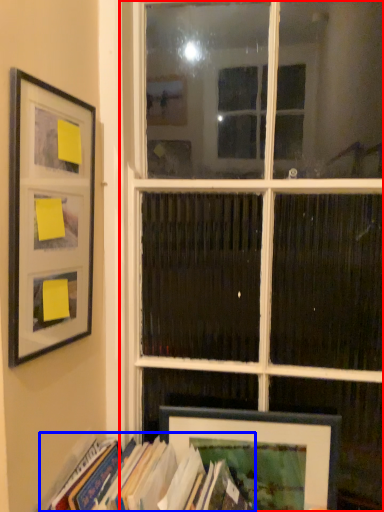
Question: Which object is closer to the camera taking this photo, window (highlighted by a red box) or book (highlighted by a blue box)?

Choices:
 (A) window
 (B) book

Answer: (B)